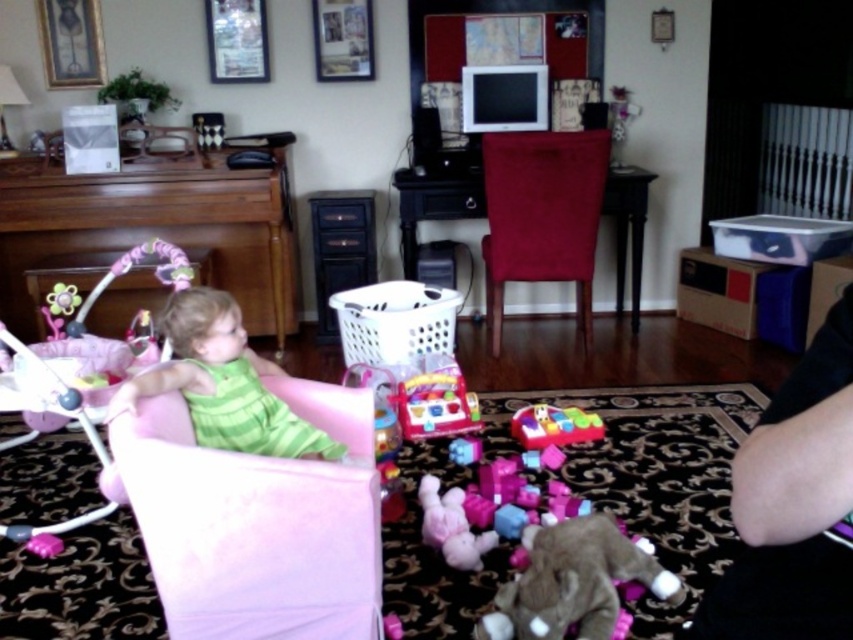
Question: Which point is farther to the camera?

Choices:
 (A) pink fabric baby carriage at left
 (B) soft plush elephant at lower center
 (C) plastic colorful car at center
 (D) fluffy pink stuffed animal at lower center

Answer: (C)

Question: Which of these objects is positioned closest to the fluffy pink stuffed animal at lower center?

Choices:
 (A) green striped fabric baby swing at left
 (B) pink fabric baby carriage at left
 (C) plastic colorful car at center
 (D) soft plush elephant at lower center

Answer: (D)

Question: Does suede-like burgundy chair at center have a larger size compared to soft plush elephant at lower center?

Choices:
 (A) no
 (B) yes

Answer: (B)

Question: Which point is closer to the camera?

Choices:
 (A) green striped fabric baby swing at left
 (B) soft plush elephant at lower center

Answer: (A)

Question: In this image, where is pink fabric chair at left located relative to green striped fabric baby swing at left?

Choices:
 (A) above
 (B) below

Answer: (B)

Question: Is pink fabric chair at left below rubberized plastic toy at center?

Choices:
 (A) no
 (B) yes

Answer: (B)